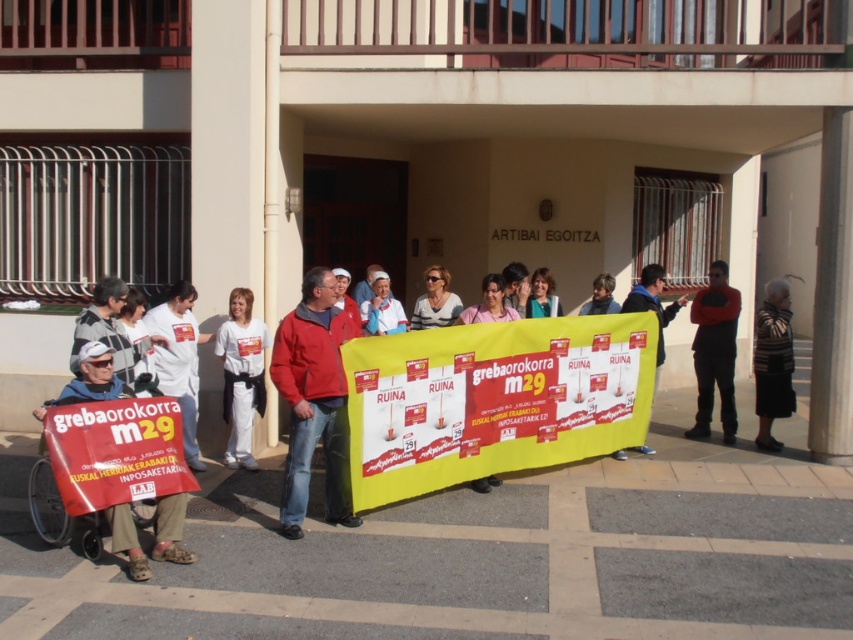
You are organizing a photo shoot and need to ensure that the striped sweater at right and the white textured shirt at center are visible in the frame. Given their sizes, which clothing item might require more careful positioning to avoid being overshadowed by other elements?

The striped sweater at right has a lesser width compared to the white textured shirt at center, so it might require more careful positioning to avoid being overshadowed by other elements due to its smaller size.

You are a photographer standing in front of the ARTIBAI EGOITZA building. You notice a matte red sign at lower left and a white textured shirt at center. Which object is nearer to you?

The matte red sign at lower left is closer to the viewer than the white textured shirt at center.

You are a photographer trying to capture a photo of the light blue fabric at center without the black leather jacket at right overlapping it. Based on their positions, is this possible?

The black leather jacket at right might be wider than light blue fabric at center, so there is a possibility of overlap. To avoid this, reposition the camera to the left side to ensure the light blue fabric at center is fully visible without obstruction from the black leather jacket at right.